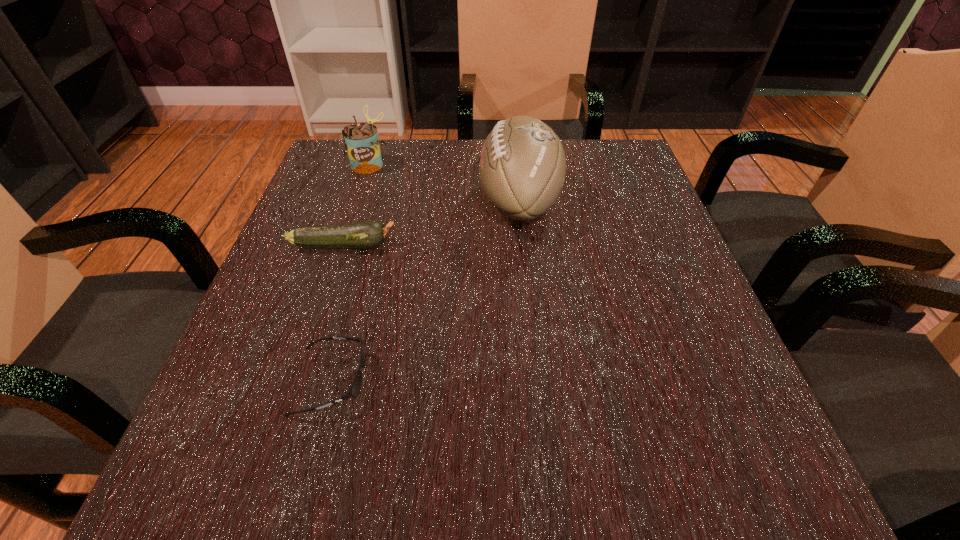
You are a GUI agent. You are given a task and a screenshot of the screen. Output one action in this format:
    pyautogui.click(x=<x>, y=<y>)
    Task: Click on the vacant region located 0.140m at the blossom end of the zucchini
    The width and height of the screenshot is (960, 540).
    Given the screenshot: What is the action you would take?
    pyautogui.click(x=468, y=245)

Locate an element on the screen. The height and width of the screenshot is (540, 960). vacant space located on the front-facing side of the nearest object is located at coordinates (435, 381).

Identify the location of football (American) that is at the far edge. This screenshot has width=960, height=540. (522, 165).

Where is `can at the far edge`? can at the far edge is located at coordinates (361, 141).

At what (x,y) coordinates should I click in order to perform the action: click on can at the left edge. Please return your answer as a coordinate pair (x, y). Image resolution: width=960 pixels, height=540 pixels. Looking at the image, I should click on (361, 141).

Locate an element on the screen. zucchini that is at the left edge is located at coordinates (368, 234).

You are a GUI agent. You are given a task and a screenshot of the screen. Output one action in this format:
    pyautogui.click(x=<x>, y=<y>)
    Task: Click on the sunglasses present at the left edge
    The width and height of the screenshot is (960, 540).
    Given the screenshot: What is the action you would take?
    pyautogui.click(x=355, y=388)

At what (x,y) coordinates should I click in order to perform the action: click on object located at the far left corner. Please return your answer as a coordinate pair (x, y). The image size is (960, 540). Looking at the image, I should click on (361, 141).

Where is `vacant region at the near edge`? This screenshot has height=540, width=960. vacant region at the near edge is located at coordinates (634, 501).

In the image, there is a desktop. Where is `free space at the left edge`? The width and height of the screenshot is (960, 540). free space at the left edge is located at coordinates (328, 368).